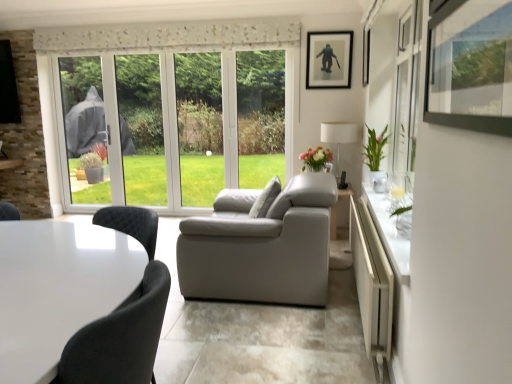
Question: From the image's perspective, is matte black picture frame at upper center located above or below matte floral arrangement at center?

Choices:
 (A) above
 (B) below

Answer: (A)

Question: Does point (331, 59) appear closer or farther from the camera than point (304, 155)?

Choices:
 (A) farther
 (B) closer

Answer: (A)

Question: Which object is positioned farthest from the white glossy table at lower left?

Choices:
 (A) green glossy vase at right
 (B) white fabric lampshade at right
 (C) matte black picture frame at upper center
 (D) white fabric pillow at center
 (E) matte floral arrangement at center

Answer: (C)

Question: Which of these objects is positioned closest to the green glossy vase at right?

Choices:
 (A) white fabric pillow at center
 (B) white fabric lampshade at right
 (C) matte black picture frame at upper center
 (D) matte floral arrangement at center
 (E) white glossy table at lower left

Answer: (D)